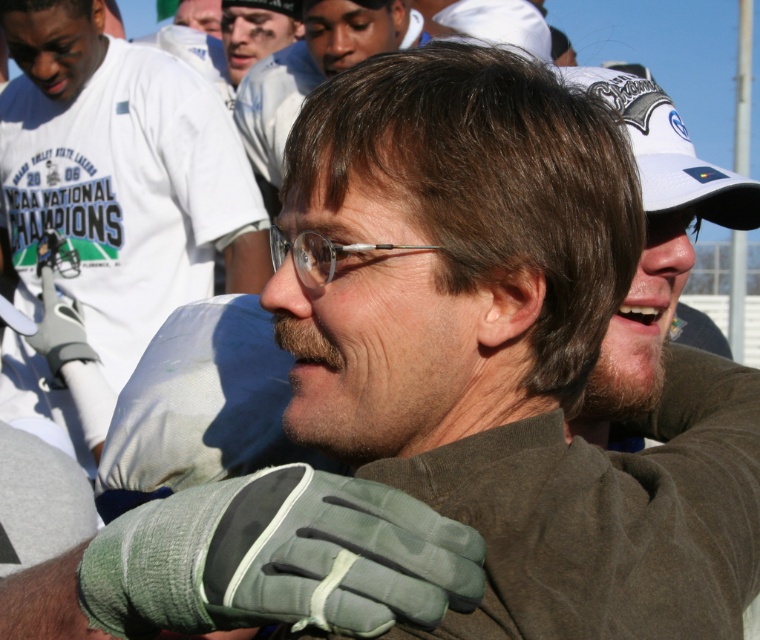
Question: Which point is farther from the camera taking this photo?

Choices:
 (A) (236, 4)
 (B) (318, 252)
 (C) (154, 144)

Answer: (A)

Question: Which of the following is the closest to the observer?

Choices:
 (A) (296, 246)
 (B) (230, 40)
 (C) (686, 157)
 (D) (399, 6)

Answer: (A)

Question: Is white fabric baseball cap at upper right wider than clear plastic glasses at center?

Choices:
 (A) yes
 (B) no

Answer: (A)

Question: Does brown matte hair at upper center appear on the left side of matte black cap at upper center?

Choices:
 (A) no
 (B) yes

Answer: (A)

Question: Which point is closer to the camera taking this photo?

Choices:
 (A) (252, 92)
 (B) (225, 19)
 (C) (220, 150)

Answer: (C)

Question: From the image, what is the correct spatial relationship of brown matte hair at upper center in relation to white fabric baseball cap at upper right?

Choices:
 (A) above
 (B) below

Answer: (A)